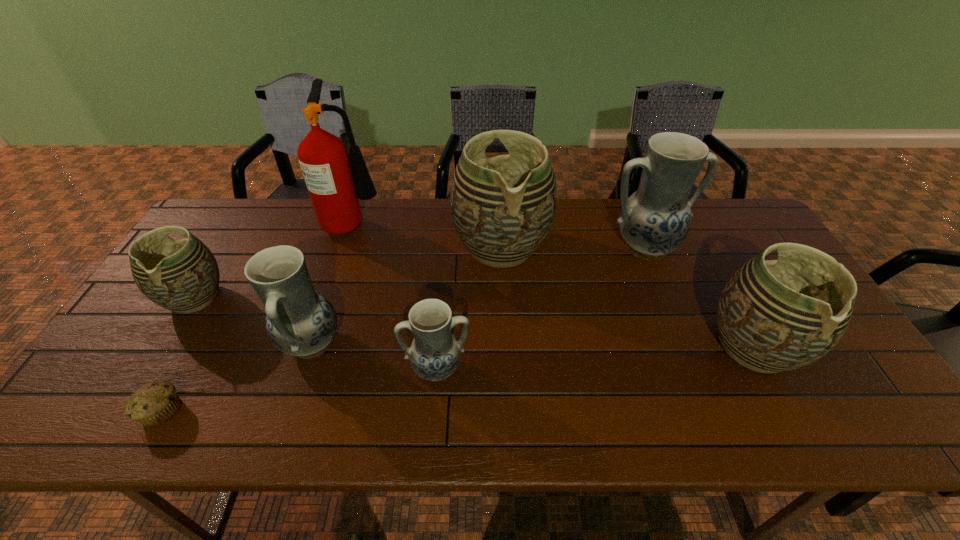
In the image, there is a desktop. In order to click on vacant space at the right edge in this screenshot , I will do `click(831, 380)`.

The width and height of the screenshot is (960, 540). What are the coordinates of `vacant area that lies between the second smallest blue pottery and the rightmost blue pottery` in the screenshot? It's located at (478, 295).

The height and width of the screenshot is (540, 960). I want to click on vacant area that lies between the second biggest brown pottery and the biggest brown pottery, so click(x=627, y=297).

The image size is (960, 540). Find the location of `vacant space that's between the farthest blue pottery and the second smallest blue pottery`. vacant space that's between the farthest blue pottery and the second smallest blue pottery is located at coordinates (478, 295).

You are a GUI agent. You are given a task and a screenshot of the screen. Output one action in this format:
    pyautogui.click(x=<x>, y=<y>)
    Task: Click on the unoccupied position between the second blue pottery from right to left and the rightmost blue pottery
    The height and width of the screenshot is (540, 960).
    Given the screenshot: What is the action you would take?
    pyautogui.click(x=541, y=308)

What are the coordinates of `vacant point located between the second biggest brown pottery and the muffin` in the screenshot? It's located at (458, 379).

At what (x,y) coordinates should I click in order to perform the action: click on unoccupied position between the farthest blue pottery and the rightmost brown pottery. Please return your answer as a coordinate pair (x, y). Looking at the image, I should click on (700, 297).

You are a GUI agent. You are given a task and a screenshot of the screen. Output one action in this format:
    pyautogui.click(x=<x>, y=<y>)
    Task: Click on the vacant area between the red fire extinguisher and the second biggest blue pottery
    The width and height of the screenshot is (960, 540).
    Given the screenshot: What is the action you would take?
    pyautogui.click(x=332, y=282)

Where is `free point between the second smallest brown pottery and the nearest object`? free point between the second smallest brown pottery and the nearest object is located at coordinates (458, 379).

At what (x,y) coordinates should I click in order to perform the action: click on vacant point located between the biggest brown pottery and the rightmost blue pottery. Please return your answer as a coordinate pair (x, y). Looking at the image, I should click on (573, 247).